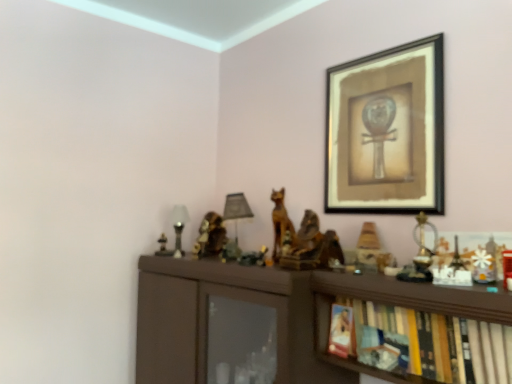
Question: Is matte glass table lamp at left, which ranks as the 2th table lamp in right-to-left order, at the left side of black matte picture frame at upper right?

Choices:
 (A) no
 (B) yes

Answer: (B)

Question: Is the position of matte glass table lamp at left, which ranks as the 2th table lamp in right-to-left order, less distant than that of black matte picture frame at upper right?

Choices:
 (A) yes
 (B) no

Answer: (B)

Question: Considering the relative positions of matte glass table lamp at left, which ranks as the 2th table lamp in right-to-left order, and black matte picture frame at upper right in the image provided, is matte glass table lamp at left, which ranks as the 2th table lamp in right-to-left order, to the right of black matte picture frame at upper right from the viewer's perspective?

Choices:
 (A) no
 (B) yes

Answer: (A)

Question: Considering the relative sizes of matte glass table lamp at left, which ranks as the 2th table lamp in right-to-left order, and black matte picture frame at upper right in the image provided, is matte glass table lamp at left, which ranks as the 2th table lamp in right-to-left order, taller than black matte picture frame at upper right?

Choices:
 (A) no
 (B) yes

Answer: (A)

Question: Can you confirm if matte glass table lamp at left, which ranks as the 2th table lamp in right-to-left order, is shorter than black matte picture frame at upper right?

Choices:
 (A) no
 (B) yes

Answer: (B)

Question: Is point (239, 205) closer or farther from the camera than point (176, 235)?

Choices:
 (A) closer
 (B) farther

Answer: (A)

Question: Considering the positions of matte black table lamp at center, the 2th table lamp positioned from the left, and matte glass table lamp at left, which ranks as the 2th table lamp in right-to-left order, in the image, is matte black table lamp at center, the 2th table lamp positioned from the left, taller or shorter than matte glass table lamp at left, which ranks as the 2th table lamp in right-to-left order,?

Choices:
 (A) tall
 (B) short

Answer: (A)

Question: Is matte black table lamp at center, the 2th table lamp positioned from the left, in front of or behind matte glass table lamp at left, which ranks as the 1th table lamp in left-to-right order, in the image?

Choices:
 (A) front
 (B) behind

Answer: (A)

Question: Is matte black table lamp at center, the 1th table lamp viewed from the right, wider or thinner than matte glass table lamp at left, which ranks as the 1th table lamp in left-to-right order?

Choices:
 (A) thin
 (B) wide

Answer: (B)

Question: In the image, is black matte picture frame at upper right on the left side or the right side of metallic gold statue at right, arranged as the 2th toy when viewed from the front?

Choices:
 (A) right
 (B) left

Answer: (B)

Question: Is point (372, 64) positioned closer to the camera than point (417, 259)?

Choices:
 (A) farther
 (B) closer

Answer: (A)

Question: From the image's perspective, is black matte picture frame at upper right positioned above or below metallic gold statue at right, arranged as the 3th toy when viewed from the left?

Choices:
 (A) below
 (B) above

Answer: (B)

Question: From a real-world perspective, is black matte picture frame at upper right above or below metallic gold statue at right, arranged as the 3th toy when viewed from the left?

Choices:
 (A) below
 (B) above

Answer: (B)

Question: In the image, is wooden figurine at center-right, the 2th toy in the left-to-right sequence, on the left side or the right side of wooden statue at center?

Choices:
 (A) left
 (B) right

Answer: (B)

Question: Choose the correct answer: Is wooden figurine at center-right, which is counted as the third toy, starting from the right, inside wooden statue at center or outside it?

Choices:
 (A) outside
 (B) inside

Answer: (A)